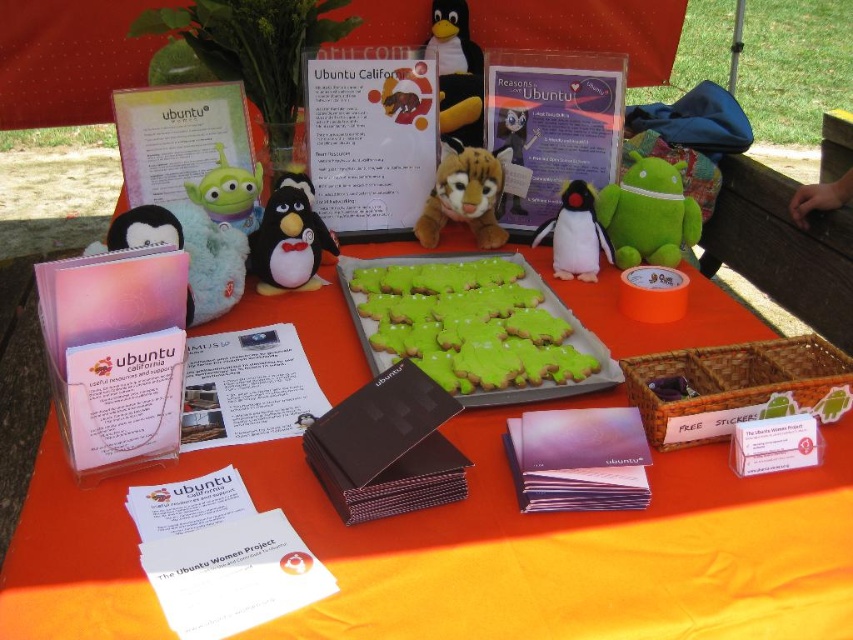
Question: Can you confirm if black plush penguin at upper center is positioned below white plush penguin at center?

Choices:
 (A) no
 (B) yes

Answer: (A)

Question: Which point is closer to the camera?

Choices:
 (A) (618, 202)
 (B) (592, 200)

Answer: (B)

Question: Which point appears closest to the camera in this image?

Choices:
 (A) (466, 77)
 (B) (381, 337)
 (C) (294, 211)

Answer: (B)

Question: Among these points, which one is nearest to the camera?

Choices:
 (A) (207, 180)
 (B) (718, 289)

Answer: (B)

Question: Can you confirm if green frosted cookies at center is smaller than matte black plush penguin at center?

Choices:
 (A) yes
 (B) no

Answer: (B)

Question: Is green frosted cookies at center to the left of green frosted sugar cookies at center from the viewer's perspective?

Choices:
 (A) yes
 (B) no

Answer: (A)